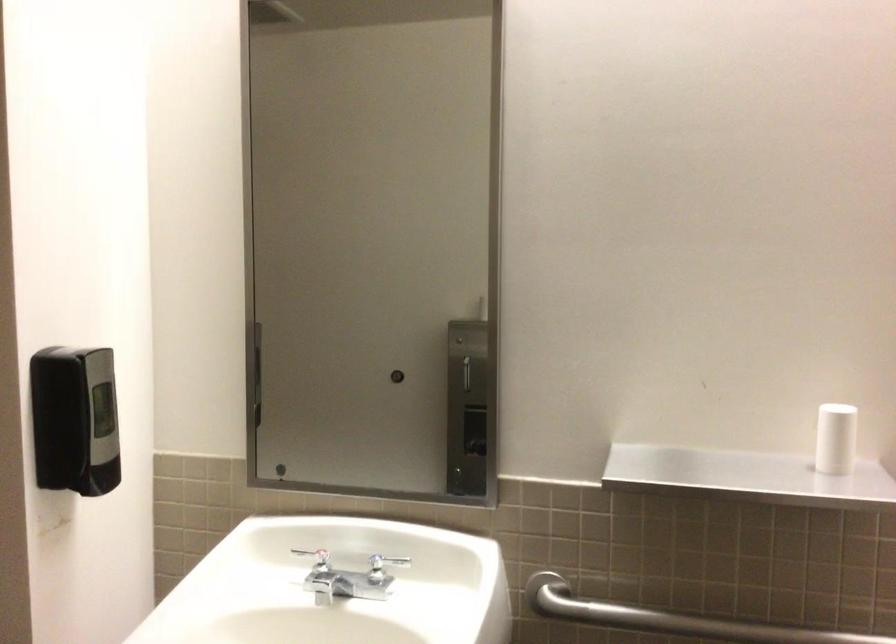
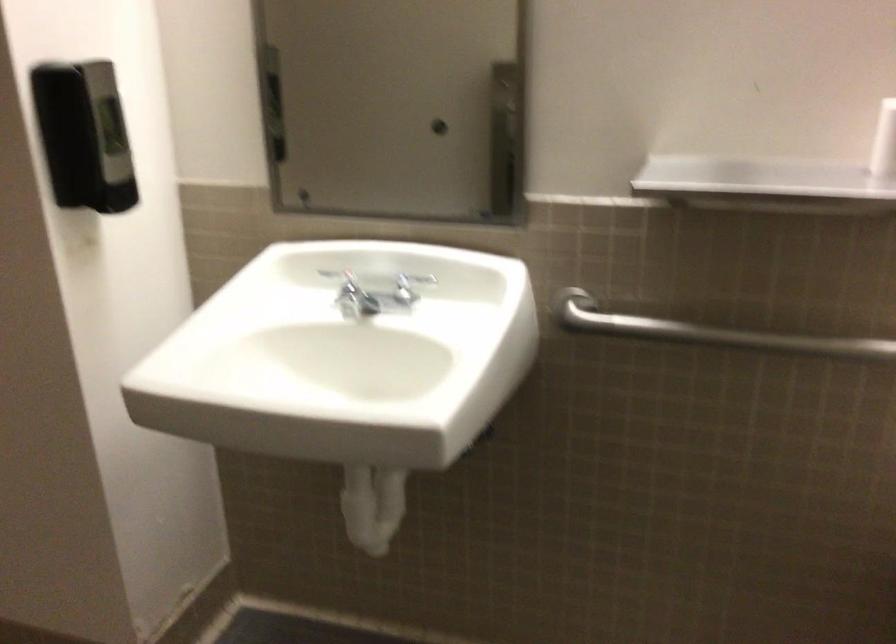
Where in the second image is the point corresponding to [319,570] from the first image?

(346, 290)